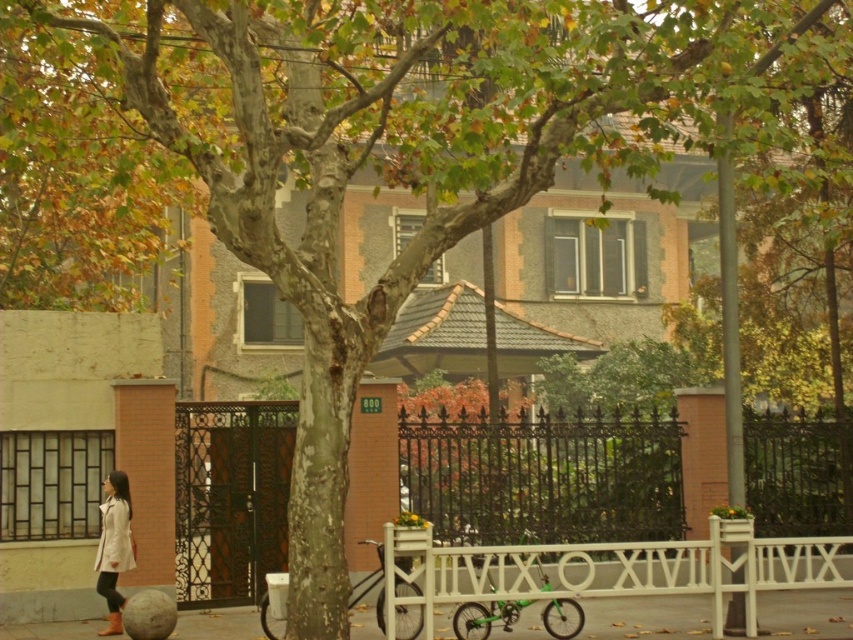
Question: Does white painted metal fence at center appear on the left side of smooth concrete pavement at lower center?

Choices:
 (A) yes
 (B) no

Answer: (A)

Question: Is white painted metal fence at center smaller than smooth concrete pavement at lower center?

Choices:
 (A) no
 (B) yes

Answer: (A)

Question: Which of the following is the farthest from the observer?

Choices:
 (A) (529, 472)
 (B) (242, 612)
 (C) (115, 474)

Answer: (A)

Question: Among these objects, which one is farthest from the camera?

Choices:
 (A) smooth concrete pavement at lower center
 (B) white painted metal fence at center
 (C) light beige coat at lower left

Answer: (B)

Question: Based on their relative distances, which object is farther from the smooth concrete pavement at lower center?

Choices:
 (A) light beige coat at lower left
 (B) white painted metal fence at center

Answer: (B)

Question: Observing the image, what is the correct spatial positioning of white painted metal fence at center in reference to light beige coat at lower left?

Choices:
 (A) left
 (B) right

Answer: (B)